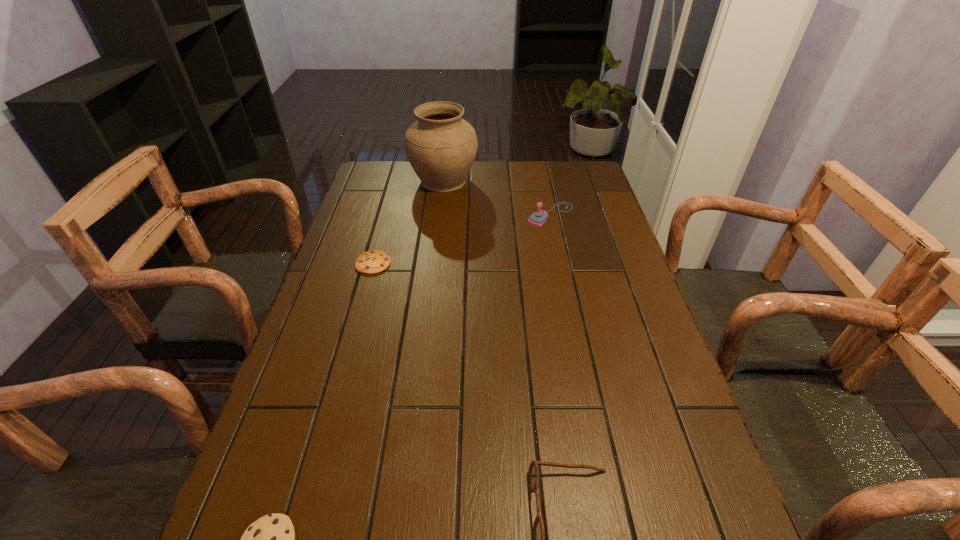
At what (x,y) coordinates should I click in order to perform the action: click on the tallest object. Please return your answer as a coordinate pair (x, y). The height and width of the screenshot is (540, 960). Looking at the image, I should click on (441, 147).

What are the coordinates of `urn` in the screenshot? It's located at (441, 147).

At what (x,y) coordinates should I click in order to perform the action: click on joystick. Please return your answer as a coordinate pair (x, y). This screenshot has height=540, width=960. Looking at the image, I should click on coord(538,218).

At what (x,y) coordinates should I click in order to perform the action: click on the fourth nearest object. Please return your answer as a coordinate pair (x, y). The height and width of the screenshot is (540, 960). Looking at the image, I should click on (538, 218).

Locate an element on the screen. the shorter cookie is located at coordinates coord(374,261).

Where is `the farther cookie`? The width and height of the screenshot is (960, 540). the farther cookie is located at coordinates (374, 261).

This screenshot has height=540, width=960. I want to click on free region located 0.100m on the left of the farthest object, so click(x=382, y=180).

This screenshot has height=540, width=960. What are the coordinates of `vacant region located on the front of the joystick` in the screenshot? It's located at (564, 274).

Where is `free space located 0.280m on the back of the shorter cookie`? The height and width of the screenshot is (540, 960). free space located 0.280m on the back of the shorter cookie is located at coordinates (391, 202).

Where is `object that is positioned at the far edge`? object that is positioned at the far edge is located at coordinates (441, 147).